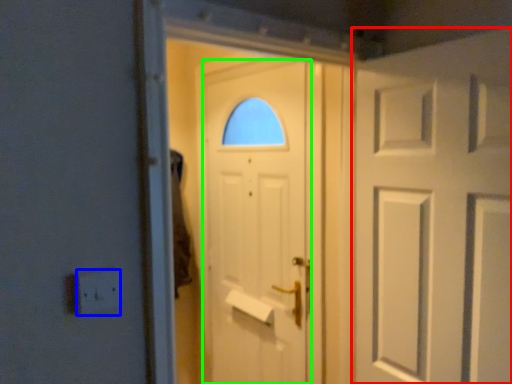
Question: Based on their relative distances, which object is nearer to door (highlighted by a red box)? Choose from electric outlet (highlighted by a blue box) and door (highlighted by a green box).

Choices:
 (A) electric outlet
 (B) door

Answer: (B)